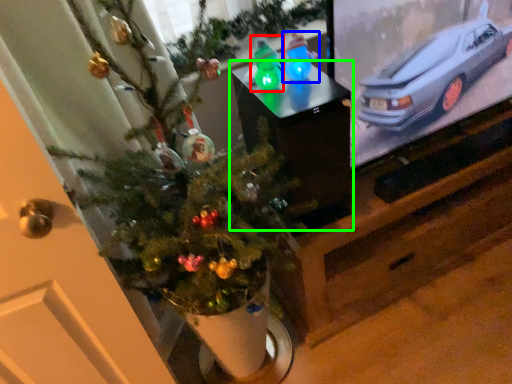
Question: Which object is the closest to the toy (highlighted by a red box)? Choose among these: toy (highlighted by a blue box) or furniture (highlighted by a green box).

Choices:
 (A) toy
 (B) furniture

Answer: (A)